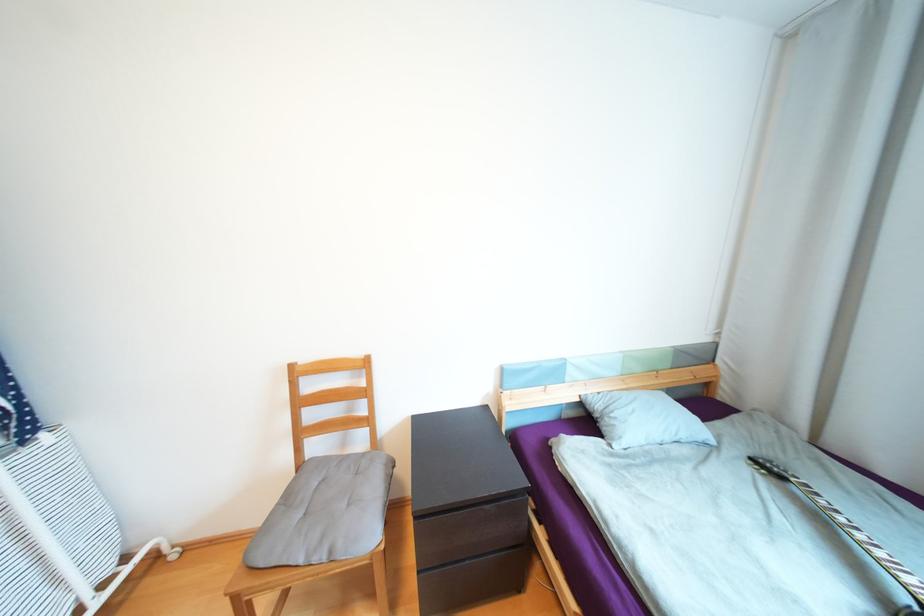
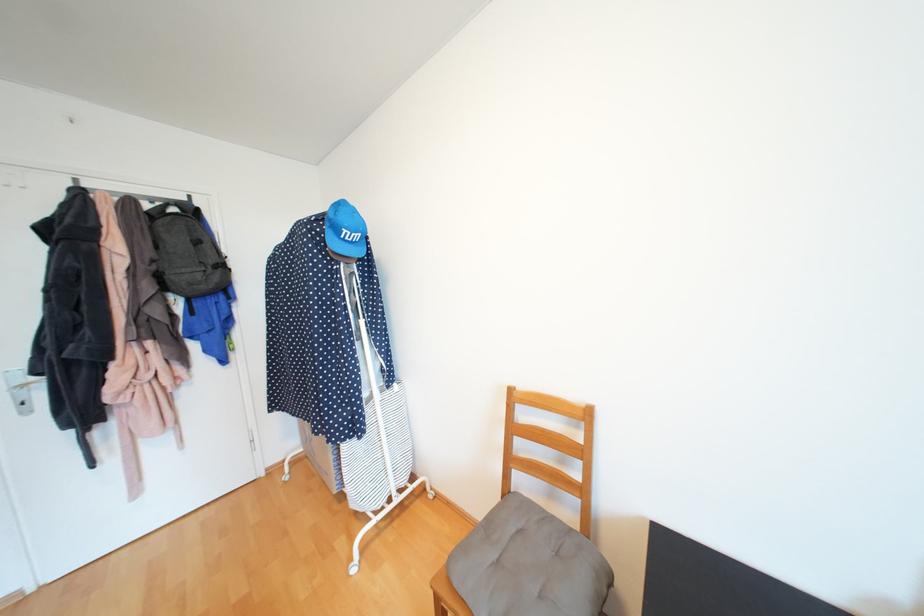
Question: The camera is either moving clockwise (left) or counter-clockwise (right) around the object. The first image is from the beginning of the video and the second image is from the end. Is the camera moving left or right when shooting the video?

Choices:
 (A) Left
 (B) Right

Answer: (B)